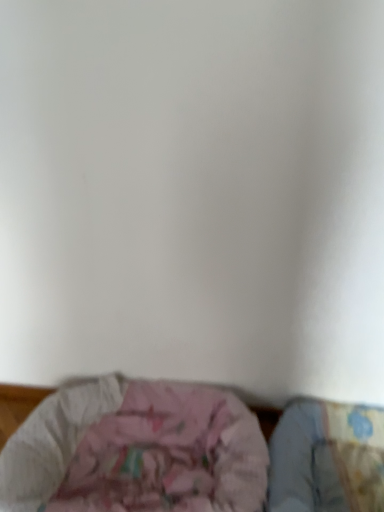
Question: Considering the relative positions of fluffy cotton sheet at lower right and pink fabric cushion at lower center in the image provided, is fluffy cotton sheet at lower right behind pink fabric cushion at lower center?

Choices:
 (A) yes
 (B) no

Answer: (A)

Question: Is fluffy cotton sheet at lower right positioned with its back to pink fabric cushion at lower center?

Choices:
 (A) no
 (B) yes

Answer: (A)

Question: Is fluffy cotton sheet at lower right at the left side of pink fabric cushion at lower center?

Choices:
 (A) no
 (B) yes

Answer: (A)

Question: Are fluffy cotton sheet at lower right and pink fabric cushion at lower center making contact?

Choices:
 (A) yes
 (B) no

Answer: (B)

Question: Does fluffy cotton sheet at lower right have a greater height compared to pink fabric cushion at lower center?

Choices:
 (A) yes
 (B) no

Answer: (A)

Question: Is fluffy cotton sheet at lower right outside of pink fabric cushion at lower center?

Choices:
 (A) yes
 (B) no

Answer: (A)

Question: Can we say pink fabric cushion at lower center lies outside fluffy cotton sheet at lower right?

Choices:
 (A) yes
 (B) no

Answer: (A)

Question: Is pink fabric cushion at lower center positioned far away from fluffy cotton sheet at lower right?

Choices:
 (A) no
 (B) yes

Answer: (A)

Question: Does pink fabric cushion at lower center have a greater height compared to fluffy cotton sheet at lower right?

Choices:
 (A) yes
 (B) no

Answer: (B)

Question: Can you confirm if pink fabric cushion at lower center is thinner than fluffy cotton sheet at lower right?

Choices:
 (A) no
 (B) yes

Answer: (A)

Question: From a real-world perspective, is pink fabric cushion at lower center physically below fluffy cotton sheet at lower right?

Choices:
 (A) no
 (B) yes

Answer: (A)

Question: From the image's perspective, is pink fabric cushion at lower center over fluffy cotton sheet at lower right?

Choices:
 (A) yes
 (B) no

Answer: (A)

Question: Is pink fabric cushion at lower center to the left or to the right of fluffy cotton sheet at lower right in the image?

Choices:
 (A) left
 (B) right

Answer: (A)